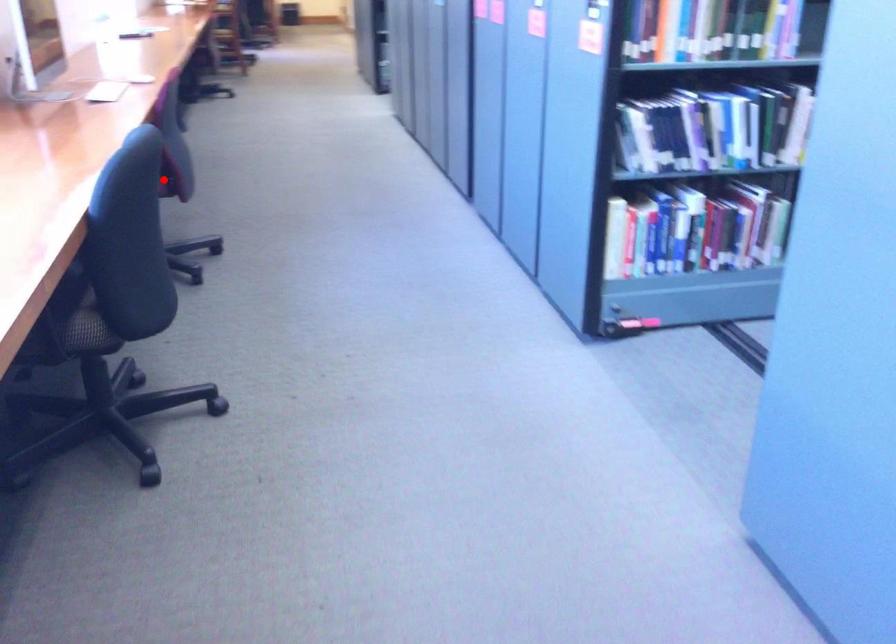
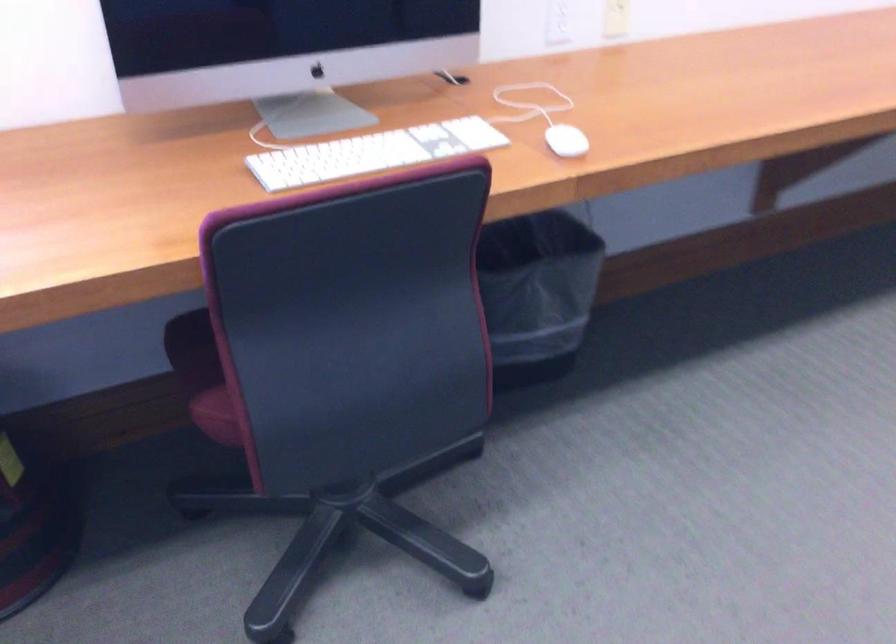
Question: I am providing you with two images of the same scene from different viewpoints. Image1 has a red point marked. In image2, the corresponding 3D location appears at what relative position? Reply with the corresponding letter.

Choices:
 (A) Closer
 (B) Farther

Answer: (A)